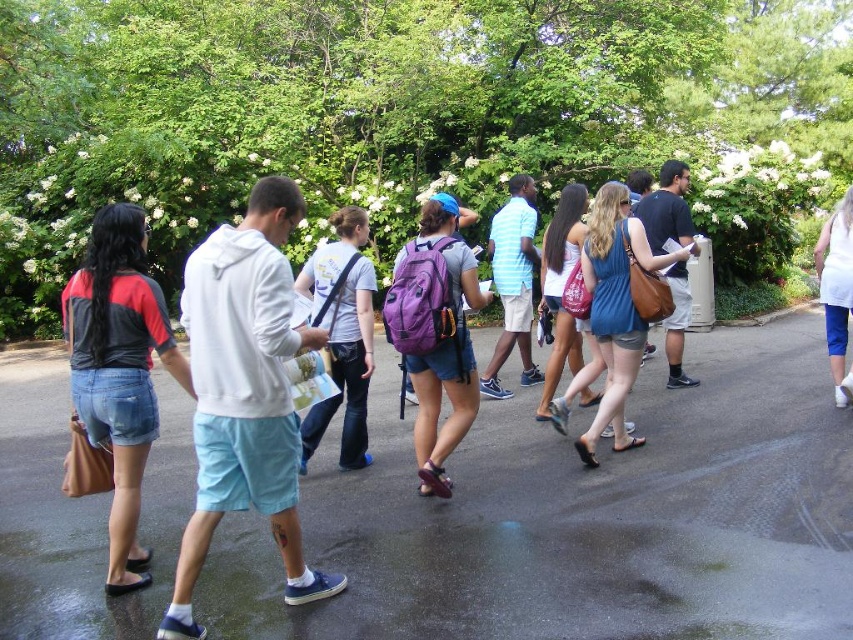
You are a tour guide leading a group along the paved path. You notice two points marked on your map at coordinates point (521, 493) and point (434, 472). According to the map, which point is located further back along the path?

Point (521, 493) is behind point (434, 472), so it is further back along the path.

You are standing at the point labeled point (250, 388). There is a tree with white blossoms 3.39 meters away from you. Can you safely walk in a straight line to reach the tree without stepping on any other objects?

Yes, because the distance between you and the tree with white blossoms is exactly 3.39 meters, and there are no other objects mentioned in the scene that would block your path.